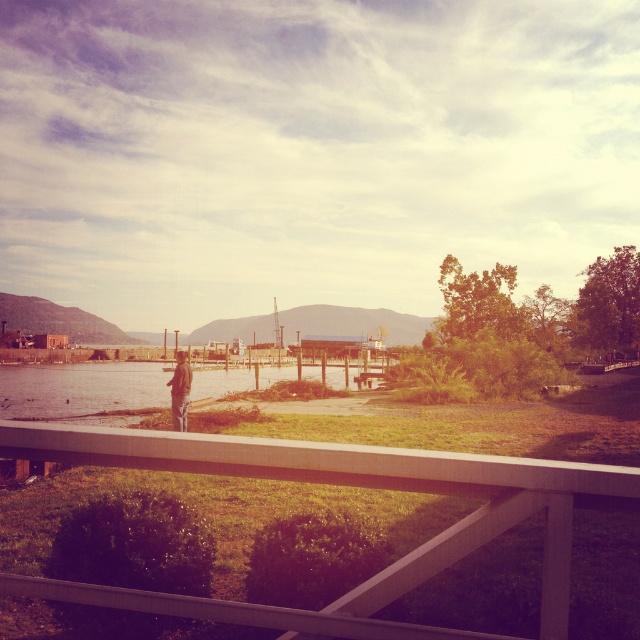
Which of these two, smooth concrete lake at center or brown leather jacket at lower center, stands taller?

smooth concrete lake at center

Locate an element on the screen. smooth concrete lake at center is located at coordinates [x=81, y=387].

Is white matte rail at center shorter than smooth concrete lake at center?

Yes.

Measure the distance between point (x=440, y=632) and camera.

A distance of 8.24 feet exists between point (x=440, y=632) and camera.

This screenshot has width=640, height=640. What are the coordinates of `white matte rail at center` in the screenshot? It's located at (342, 484).

Locate an element on the screen. This screenshot has height=640, width=640. white matte rail at center is located at coordinates (342, 484).

Who is positioned more to the left, white matte rail at center or brown leather jacket at lower center?

brown leather jacket at lower center

Is point (566, 512) less distant than point (173, 392)?

Yes, it is in front of point (173, 392).

You are a GUI agent. You are given a task and a screenshot of the screen. Output one action in this format:
    pyautogui.click(x=<x>, y=<y>)
    Task: Click on the white matte rail at center
    The height and width of the screenshot is (640, 640).
    Given the screenshot: What is the action you would take?
    pyautogui.click(x=342, y=484)